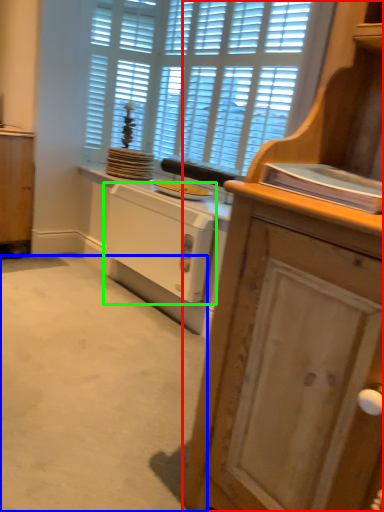
Question: Estimate the real-world distances between objects in this image. Which object is farther from cabinetry (highlighted by a red box), plain (highlighted by a blue box) or home appliance (highlighted by a green box)?

Choices:
 (A) plain
 (B) home appliance

Answer: (B)